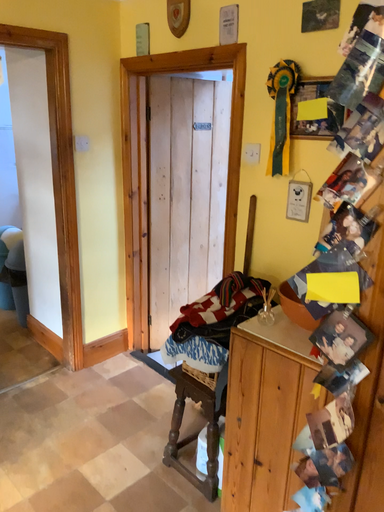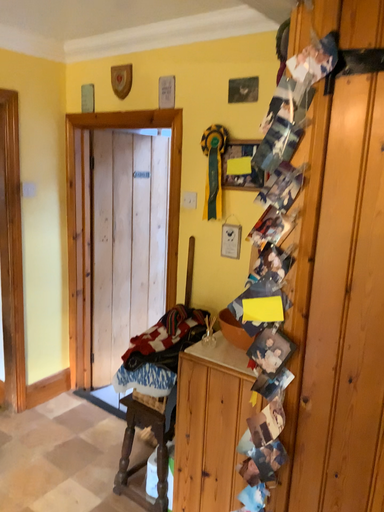
Question: Which way did the camera rotate in the video?

Choices:
 (A) rotated left
 (B) rotated right

Answer: (B)